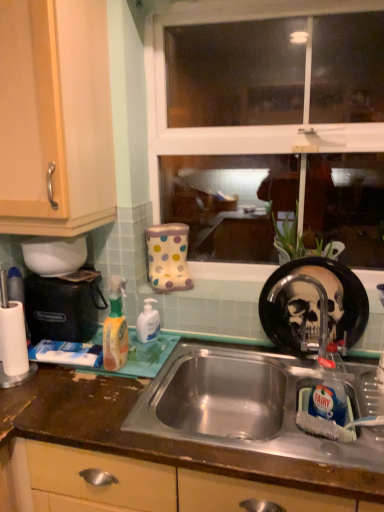
Question: Could you tell me if black plastic coffee machine at left is turned towards translucent orange spray bottle at left, the second cleaning product when ordered from right to left?

Choices:
 (A) yes
 (B) no

Answer: (B)

Question: Can you confirm if black plastic coffee machine at left is positioned to the right of translucent orange spray bottle at left, marked as the first cleaning product in a left-to-right arrangement?

Choices:
 (A) no
 (B) yes

Answer: (A)

Question: Considering the relative sizes of black plastic coffee machine at left and translucent orange spray bottle at left, the second cleaning product in the back-to-front sequence, in the image provided, is black plastic coffee machine at left bigger than translucent orange spray bottle at left, the second cleaning product in the back-to-front sequence,?

Choices:
 (A) yes
 (B) no

Answer: (A)

Question: Is black plastic coffee machine at left to the left of translucent orange spray bottle at left, the second cleaning product in the back-to-front sequence, from the viewer's perspective?

Choices:
 (A) yes
 (B) no

Answer: (A)

Question: From a real-world perspective, is black plastic coffee machine at left physically above translucent orange spray bottle at left, the 1th cleaning product viewed from the front?

Choices:
 (A) no
 (B) yes

Answer: (A)

Question: From a real-world perspective, relative to white glossy hand soap at center, which is the first cleaning product in right-to-left order, is black plastic coffee machine at left vertically above or below?

Choices:
 (A) above
 (B) below

Answer: (A)

Question: In the image, is black plastic coffee machine at left positioned in front of or behind white glossy hand soap at center, placed as the 2th cleaning product when sorted from front to back?

Choices:
 (A) front
 (B) behind

Answer: (A)

Question: Looking at the image, does black plastic coffee machine at left seem bigger or smaller compared to white glossy hand soap at center, placed as the second cleaning product when sorted from left to right?

Choices:
 (A) big
 (B) small

Answer: (A)

Question: Does point (77, 327) appear closer or farther from the camera than point (137, 330)?

Choices:
 (A) farther
 (B) closer

Answer: (B)

Question: In terms of width, does brushed metal faucet at sink right look wider or thinner when compared to white glossy hand soap at center, the first cleaning product from the back?

Choices:
 (A) thin
 (B) wide

Answer: (B)

Question: Based on their positions, is brushed metal faucet at sink right located to the left or right of white glossy hand soap at center, the first cleaning product from the back?

Choices:
 (A) right
 (B) left

Answer: (A)

Question: From a real-world perspective, relative to white glossy hand soap at center, placed as the 2th cleaning product when sorted from front to back, is brushed metal faucet at sink right vertically above or below?

Choices:
 (A) below
 (B) above

Answer: (B)

Question: Considering the positions of brushed metal faucet at sink right and white glossy hand soap at center, placed as the second cleaning product when sorted from left to right, in the image, is brushed metal faucet at sink right taller or shorter than white glossy hand soap at center, placed as the second cleaning product when sorted from left to right,?

Choices:
 (A) tall
 (B) short

Answer: (A)

Question: Based on their sizes in the image, would you say translucent orange spray bottle at left, marked as the first cleaning product in a left-to-right arrangement, is bigger or smaller than brown laminate countertop at center?

Choices:
 (A) small
 (B) big

Answer: (A)

Question: Is point 117,308 positioned closer to the camera than point 332,462?

Choices:
 (A) farther
 (B) closer

Answer: (A)